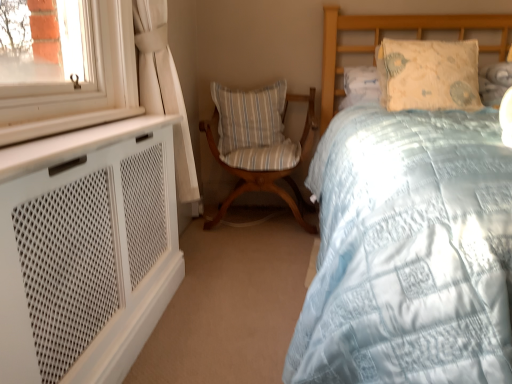
The image size is (512, 384). What are the coordinates of `woodenchair at center` in the screenshot? It's located at (258, 144).

The width and height of the screenshot is (512, 384). Describe the element at coordinates (258, 144) in the screenshot. I see `woodenchair at center` at that location.

You are a GUI agent. You are given a task and a screenshot of the screen. Output one action in this format:
    pyautogui.click(x=<x>, y=<y>)
    Task: Click on the light blue quilted bed at center
    The height and width of the screenshot is (384, 512).
    Given the screenshot: What is the action you would take?
    pyautogui.click(x=409, y=253)

Is striped fabric pillow at center, the 1th pillow in the back-to-front sequence, to the right of light blue quilted bed at center from the viewer's perspective?

Incorrect, striped fabric pillow at center, the 1th pillow in the back-to-front sequence, is not on the right side of light blue quilted bed at center.

Is striped fabric pillow at center, the 1th pillow when ordered from left to right, with light blue quilted bed at center?

There is a gap between striped fabric pillow at center, the 1th pillow when ordered from left to right, and light blue quilted bed at center.

Is striped fabric pillow at center, the 1th pillow in the back-to-front sequence, bigger than light blue quilted bed at center?

No, striped fabric pillow at center, the 1th pillow in the back-to-front sequence, is not bigger than light blue quilted bed at center.

In the image, there is a light blue quilted bed at center. Identify the location of chair below it (from a real-world perspective). The width and height of the screenshot is (512, 384). (258, 144).

From the picture: How far apart are woodenchair at center and light blue quilted bed at center?

woodenchair at center is 3.89 feet away from light blue quilted bed at center.

From the image's perspective, is woodenchair at center below light blue quilted bed at center?

Incorrect, from the image's perspective, woodenchair at center is higher than light blue quilted bed at center.

Between point (469, 96) and point (359, 148), which one is positioned behind?

The point (469, 96) is farther.

Is light blue quilted pillow at upper right, which is the 1th pillow in front-to-back order, in front of or behind light blue quilted bed at center in the image?

Visually, light blue quilted pillow at upper right, which is the 1th pillow in front-to-back order, is located behind light blue quilted bed at center.

Where is `pillow lying on the right of light blue quilted bed at center`? pillow lying on the right of light blue quilted bed at center is located at coordinates (428, 74).

Which object is more forward, striped fabric pillow at center, which is the 2th pillow in front-to-back order, or light blue quilted pillow at upper right, which is the 1th pillow in front-to-back order?

light blue quilted pillow at upper right, which is the 1th pillow in front-to-back order, is more forward.

Looking at this image, considering the sizes of objects striped fabric pillow at center, the 1th pillow in the back-to-front sequence, and light blue quilted pillow at upper right, positioned as the 2th pillow in left-to-right order, in the image provided, who is smaller, striped fabric pillow at center, the 1th pillow in the back-to-front sequence, or light blue quilted pillow at upper right, positioned as the 2th pillow in left-to-right order,?

striped fabric pillow at center, the 1th pillow in the back-to-front sequence, is smaller.

Consider the image. How far apart are striped fabric pillow at center, the 2th pillow when ordered from right to left, and light blue quilted pillow at upper right, placed as the 1th pillow when sorted from right to left?

81.96 centimeters.

How many degrees apart are the facing directions of striped fabric pillow at center, the 1th pillow when ordered from left to right, and light blue quilted pillow at upper right, the second pillow viewed from the back?

They differ by 2.4 degrees in their facing directions.

Is light blue quilted bed at center at the left side of striped fabric pillow at center, which is the 2th pillow in front-to-back order?

Incorrect, light blue quilted bed at center is not on the left side of striped fabric pillow at center, which is the 2th pillow in front-to-back order.

Could you tell me if light blue quilted bed at center is facing striped fabric pillow at center, the 1th pillow in the back-to-front sequence?

No, light blue quilted bed at center does not turn towards striped fabric pillow at center, the 1th pillow in the back-to-front sequence.

Who is more distant, light blue quilted bed at center or striped fabric pillow at center, the 1th pillow when ordered from left to right?

striped fabric pillow at center, the 1th pillow when ordered from left to right, is behind.

Considering the points (465, 132) and (436, 46), which point is in front, point (465, 132) or point (436, 46)?

The point (465, 132) is more forward.

Does light blue quilted bed at center have a larger size compared to light blue quilted pillow at upper right, which is the 1th pillow in front-to-back order?

Correct, light blue quilted bed at center is larger in size than light blue quilted pillow at upper right, which is the 1th pillow in front-to-back order.

Considering the positions of objects light blue quilted bed at center and light blue quilted pillow at upper right, the second pillow viewed from the back, in the image provided, who is more to the left, light blue quilted bed at center or light blue quilted pillow at upper right, the second pillow viewed from the back,?

From the viewer's perspective, light blue quilted bed at center appears more on the left side.

Does light blue quilted bed at center have a greater height compared to light blue quilted pillow at upper right, placed as the 1th pillow when sorted from right to left?

Yes, light blue quilted bed at center is taller than light blue quilted pillow at upper right, placed as the 1th pillow when sorted from right to left.

From the image's perspective, which object appears higher, woodenchair at center or striped fabric pillow at center, which is the 2th pillow in front-to-back order?

A: striped fabric pillow at center, which is the 2th pillow in front-to-back order, appears higher in the image.

Is woodenchair at center positioned far away from striped fabric pillow at center, the 2th pillow when ordered from right to left?

woodenchair at center is near striped fabric pillow at center, the 2th pillow when ordered from right to left, not far away.

Does woodenchair at center have a lesser height compared to striped fabric pillow at center, the 1th pillow when ordered from left to right?

No, woodenchair at center is not shorter than striped fabric pillow at center, the 1th pillow when ordered from left to right.

Between woodenchair at center and striped fabric pillow at center, which is the 2th pillow in front-to-back order, which one has larger size?

woodenchair at center.

Find the location of `bed on the right of the striped fabric pillow at center, the 1th pillow in the back-to-front sequence`. bed on the right of the striped fabric pillow at center, the 1th pillow in the back-to-front sequence is located at coordinates (409, 253).

Find the location of a particular element. chair below the light blue quilted bed at center (from a real-world perspective) is located at coordinates (258, 144).

Estimate the real-world distances between objects in this image. Which object is further from light blue quilted pillow at upper right, which is the 1th pillow in front-to-back order, woodenchair at center or striped fabric pillow at center, the 2th pillow when ordered from right to left?

striped fabric pillow at center, the 2th pillow when ordered from right to left.

When comparing their distances from light blue quilted pillow at upper right, the second pillow viewed from the back, does light blue quilted bed at center or striped fabric pillow at center, the 1th pillow in the back-to-front sequence, seem further?

striped fabric pillow at center, the 1th pillow in the back-to-front sequence, lies further to light blue quilted pillow at upper right, the second pillow viewed from the back, than the other object.

When comparing their distances from woodenchair at center, does light blue quilted pillow at upper right, placed as the 1th pillow when sorted from right to left, or striped fabric pillow at center, the 1th pillow in the back-to-front sequence, seem closer?

striped fabric pillow at center, the 1th pillow in the back-to-front sequence, is positioned closer to the anchor woodenchair at center.

Which object lies further to the anchor point light blue quilted bed at center, striped fabric pillow at center, which is the 2th pillow in front-to-back order, or woodenchair at center?

The object further to light blue quilted bed at center is striped fabric pillow at center, which is the 2th pillow in front-to-back order.

Based on their spatial positions, is woodenchair at center or light blue quilted pillow at upper right, positioned as the 2th pillow in left-to-right order, closer to striped fabric pillow at center, the 1th pillow in the back-to-front sequence?

woodenchair at center.

Considering their positions, is light blue quilted bed at center positioned closer to woodenchair at center than light blue quilted pillow at upper right, placed as the 1th pillow when sorted from right to left?

Among the two, light blue quilted pillow at upper right, placed as the 1th pillow when sorted from right to left, is located nearer to woodenchair at center.

Based on their spatial positions, is light blue quilted pillow at upper right, which is the 1th pillow in front-to-back order, or woodenchair at center closer to light blue quilted bed at center?

light blue quilted pillow at upper right, which is the 1th pillow in front-to-back order, is closer to light blue quilted bed at center.

Based on their spatial positions, is striped fabric pillow at center, the 1th pillow when ordered from left to right, or light blue quilted bed at center closer to woodenchair at center?

striped fabric pillow at center, the 1th pillow when ordered from left to right, lies closer to woodenchair at center than the other object.

Where is `chair positioned between light blue quilted bed at center and striped fabric pillow at center, the 1th pillow in the back-to-front sequence, from near to far`? This screenshot has height=384, width=512. chair positioned between light blue quilted bed at center and striped fabric pillow at center, the 1th pillow in the back-to-front sequence, from near to far is located at coordinates (258, 144).

Identify the location of chair between striped fabric pillow at center, the 2th pillow when ordered from right to left, and light blue quilted pillow at upper right, which is the 1th pillow in front-to-back order, in the horizontal direction. The height and width of the screenshot is (384, 512). (258, 144).

Identify the location of pillow between light blue quilted bed at center and woodenchair at center in the front-back direction. Image resolution: width=512 pixels, height=384 pixels. (428, 74).

I want to click on pillow between light blue quilted bed at center and striped fabric pillow at center, the 1th pillow when ordered from left to right, along the z-axis, so click(428, 74).